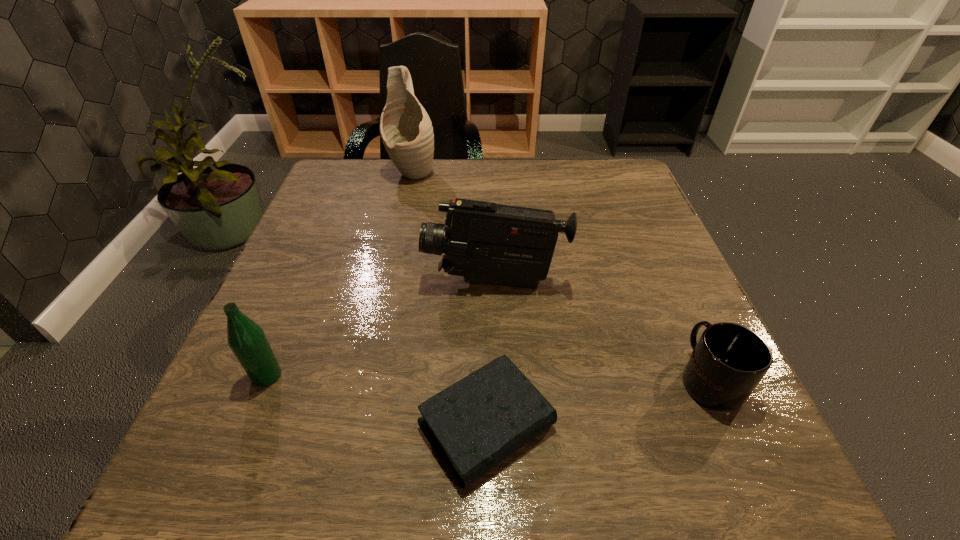
I want to click on vacant area that lies between the shortest object and the leftmost object, so click(x=376, y=400).

Image resolution: width=960 pixels, height=540 pixels. What are the coordinates of `free space between the Bible and the mug` in the screenshot? It's located at (597, 402).

In order to click on unoccupied position between the pitcher and the second shortest object in this screenshot , I will do `click(561, 275)`.

This screenshot has height=540, width=960. In order to click on vacant space that's between the leftmost object and the tallest object in this screenshot , I will do `click(340, 274)`.

This screenshot has height=540, width=960. What are the coordinates of `unoccupied area between the second object from left to right and the leftmost object` in the screenshot? It's located at (340, 274).

The image size is (960, 540). I want to click on vacant space in between the tallest object and the leftmost object, so click(340, 274).

Where is `empty location between the fourth tallest object and the farthest object`? empty location between the fourth tallest object and the farthest object is located at coordinates (561, 275).

Identify which object is the third nearest to the second farthest object. Please provide its 2D coordinates. Your answer should be formatted as a tuple, i.e. [(x, y)], where the tuple contains the x and y coordinates of a point satisfying the conditions above.

[(247, 340)]

The height and width of the screenshot is (540, 960). I want to click on object that is the closest one to the rightmost object, so click(x=487, y=242).

The width and height of the screenshot is (960, 540). In order to click on vacant space that satisfies the following two spatial constraints: 1. at the spout of the tallest object; 2. on the right side of the Bible in this screenshot , I will do pos(357,425).